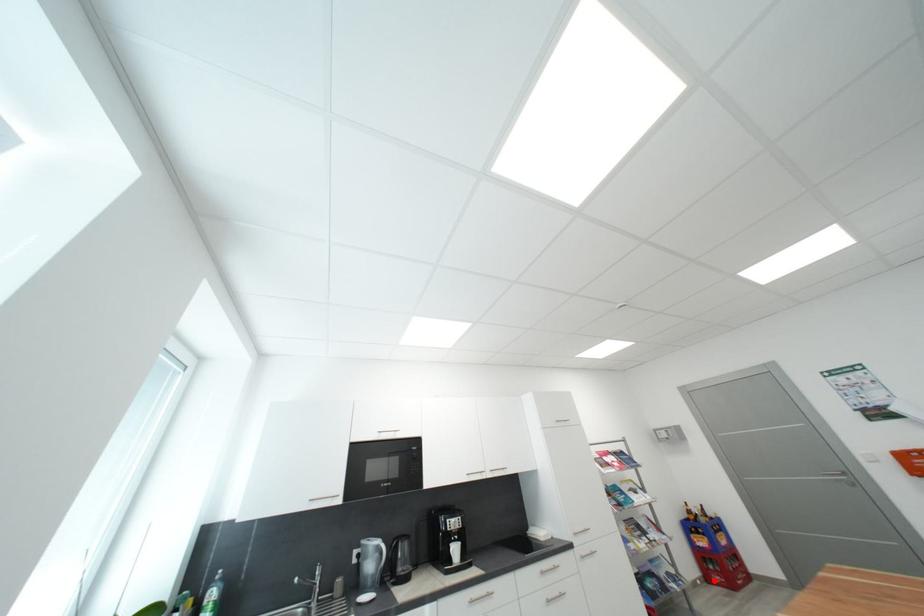
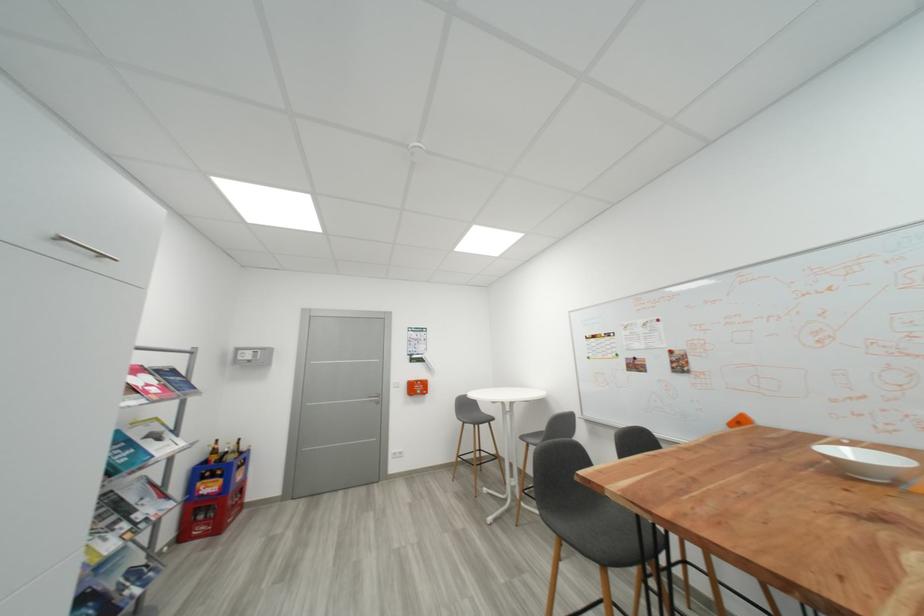
Find the pixel in the second image that matches the highlighted location in the first image.

(189, 538)